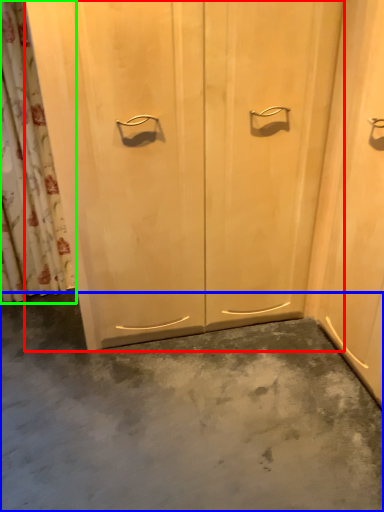
Question: Which object is the farthest from door (highlighted by a red box)? Choose among these: concrete (highlighted by a blue box) or shower curtain (highlighted by a green box).

Choices:
 (A) concrete
 (B) shower curtain

Answer: (B)